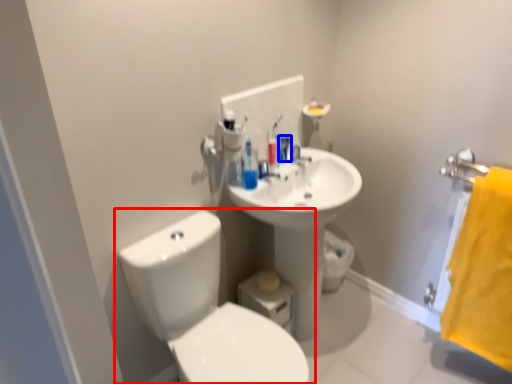
Question: Which point is further to the camera, toilet (highlighted by a red box) or mouthwash (highlighted by a blue box)?

Choices:
 (A) toilet
 (B) mouthwash

Answer: (B)